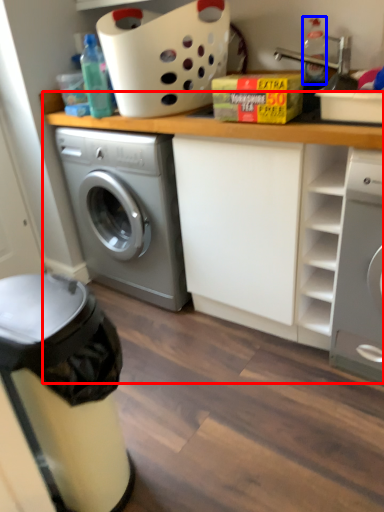
Question: Which object is further to the camera taking this photo, counter top (highlighted by a red box) or bottle (highlighted by a blue box)?

Choices:
 (A) counter top
 (B) bottle

Answer: (B)